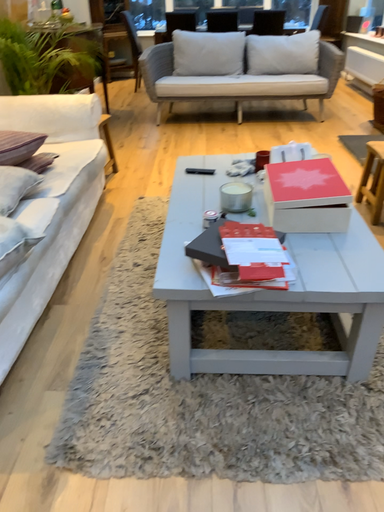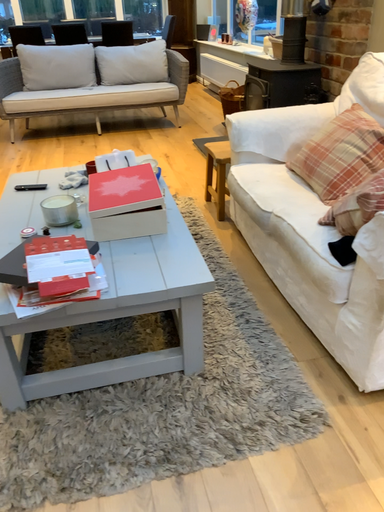
Question: Which way did the camera rotate in the video?

Choices:
 (A) rotated left
 (B) rotated right

Answer: (B)